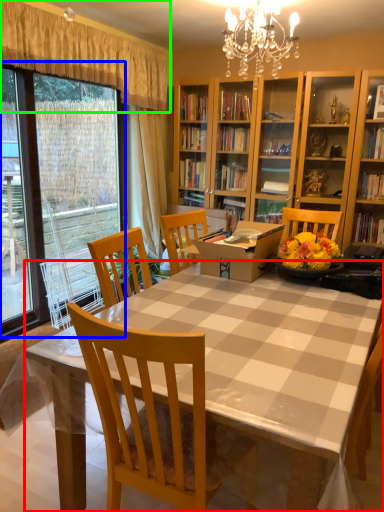
Question: Estimate the real-world distances between objects in this image. Which object is farther from desk (highlighted by a red box), glass door (highlighted by a blue box) or curtain (highlighted by a green box)?

Choices:
 (A) glass door
 (B) curtain

Answer: (B)